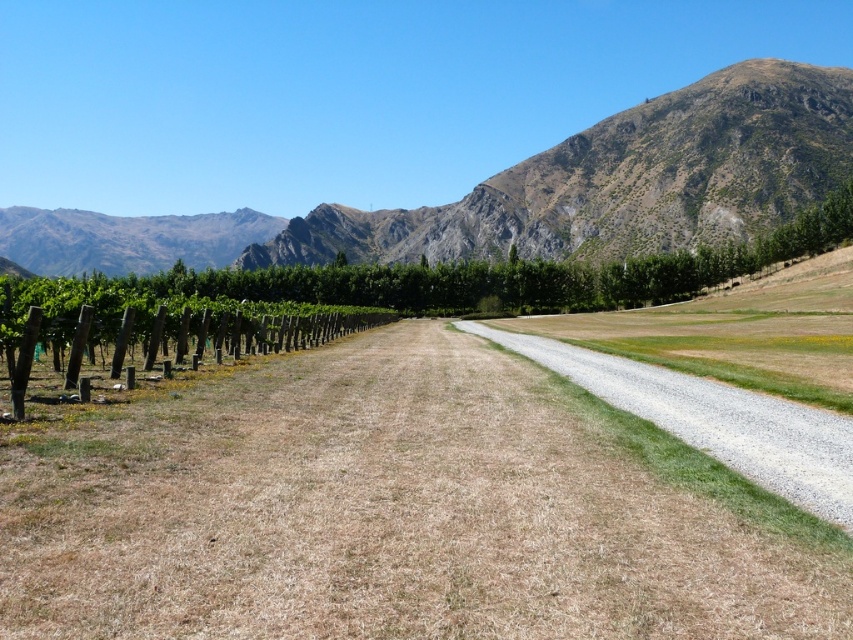
Does brown grassy dirt track at center have a larger size compared to gravelly path at center?

Yes.

You are a GUI agent. You are given a task and a screenshot of the screen. Output one action in this format:
    pyautogui.click(x=<x>, y=<y>)
    Task: Click on the brown grassy dirt track at center
    
    Given the screenshot: What is the action you would take?
    pyautogui.click(x=381, y=513)

Where is `brown grassy dirt track at center`? Image resolution: width=853 pixels, height=640 pixels. brown grassy dirt track at center is located at coordinates (381, 513).

Is brown grassy dirt track at center further to the viewer compared to rugged brown mountain at upper center?

No, brown grassy dirt track at center is in front of rugged brown mountain at upper center.

Is brown grassy dirt track at center thinner than rugged brown mountain at upper center?

Yes, brown grassy dirt track at center is thinner than rugged brown mountain at upper center.

Between point (277, 483) and point (537, 160), which one is positioned behind?

The point (537, 160) is more distant.

Identify the location of brown grassy dirt track at center. Image resolution: width=853 pixels, height=640 pixels. (381, 513).

Which of these two, rugged brown mountain at upper center or gravelly path at center, stands shorter?

gravelly path at center

Is rugged brown mountain at upper center positioned at the back of gravelly path at center?

Yes, rugged brown mountain at upper center is behind gravelly path at center.

The width and height of the screenshot is (853, 640). In order to click on rugged brown mountain at upper center in this screenshot , I will do `click(527, 192)`.